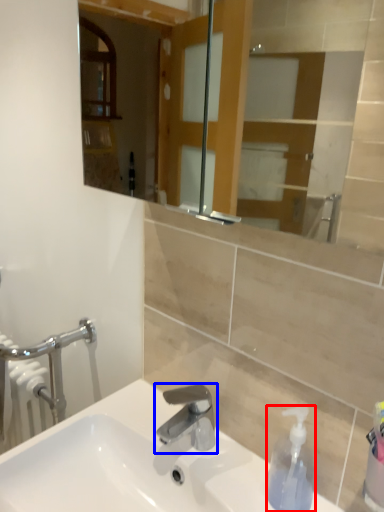
Question: Which object appears closest to the camera in this image, soap dispenser (highlighted by a red box) or tap (highlighted by a blue box)?

Choices:
 (A) soap dispenser
 (B) tap

Answer: (A)